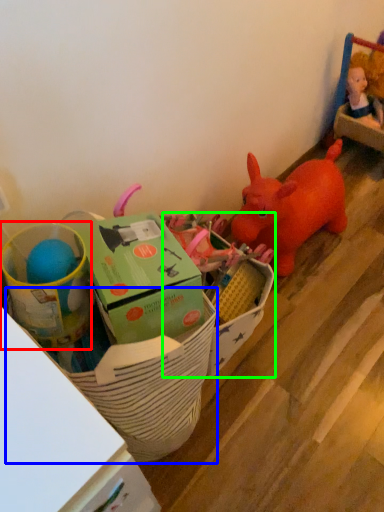
Question: Which object is the closest to the toy (highlighted by a red box)? Choose among these: basket (highlighted by a blue box) or storage box (highlighted by a green box).

Choices:
 (A) basket
 (B) storage box

Answer: (A)